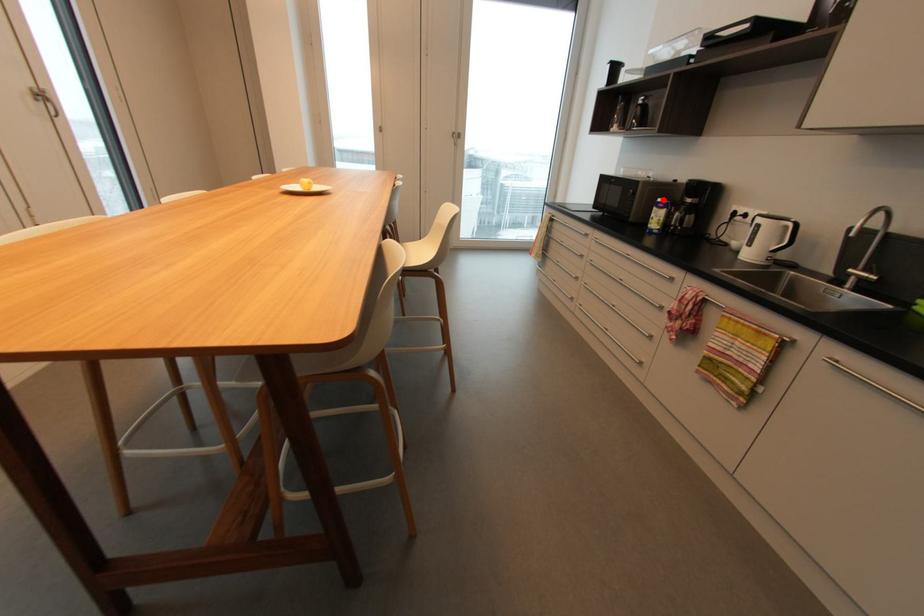
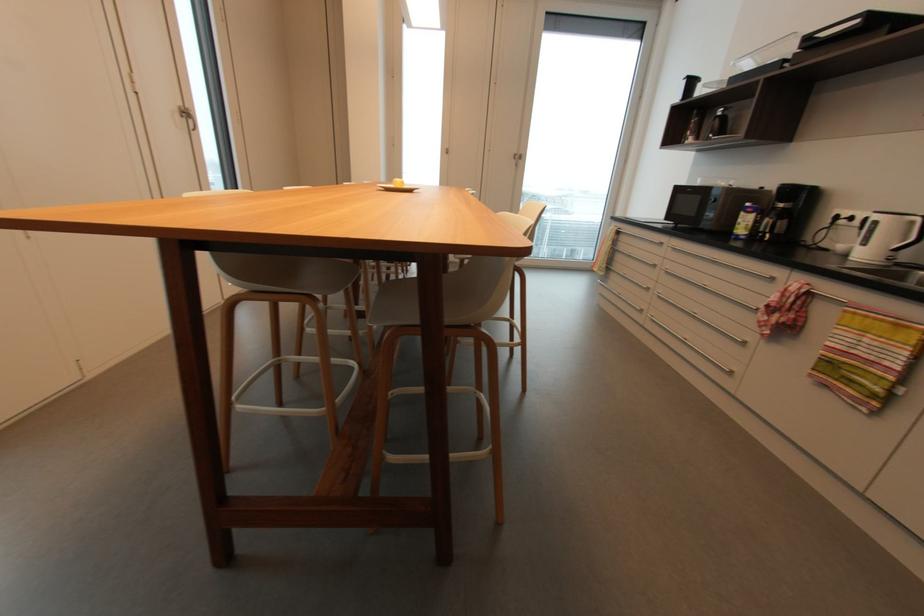
Find the pixel in the second image that matches the highlighted location in the first image.

(750, 205)